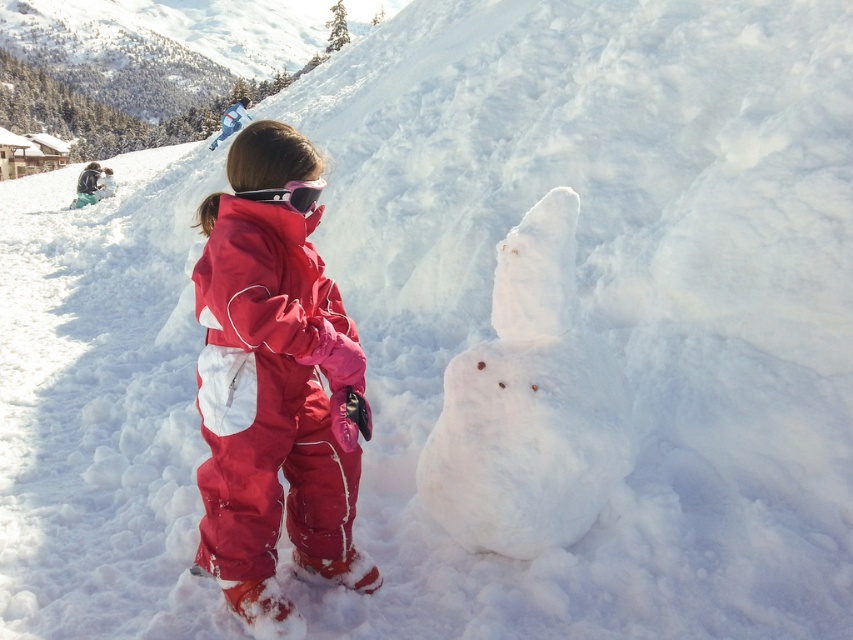
Does matte red snowsuit at center appear under pink matte goggles at center?

Correct, matte red snowsuit at center is located below pink matte goggles at center.

Can you confirm if matte red snowsuit at center is shorter than pink matte goggles at center?

Incorrect, matte red snowsuit at center's height does not fall short of pink matte goggles at center's.

Locate an element on the screen. The width and height of the screenshot is (853, 640). matte red snowsuit at center is located at coordinates (274, 392).

You are a GUI agent. You are given a task and a screenshot of the screen. Output one action in this format:
    pyautogui.click(x=<x>, y=<y>)
    Task: Click on the matte red snowsuit at center
    The image size is (853, 640).
    Given the screenshot: What is the action you would take?
    pyautogui.click(x=274, y=392)

Does white fluffy snowman at center have a lesser width compared to red matte snowsuit at center?

No, white fluffy snowman at center is not thinner than red matte snowsuit at center.

Is point (450, 360) less distant than point (229, 355)?

No, it is behind (229, 355).

The width and height of the screenshot is (853, 640). Identify the location of white fluffy snowman at center. (527, 404).

In the scene shown: Is white fluffy snowman at center below pink matte goggles at center?

Yes, white fluffy snowman at center is below pink matte goggles at center.

Can you confirm if white fluffy snowman at center is positioned to the right of pink matte goggles at center?

Yes, white fluffy snowman at center is to the right of pink matte goggles at center.

Measure the distance between white fluffy snowman at center and camera.

A distance of 11.92 feet exists between white fluffy snowman at center and camera.

Find the location of a particular element. This screenshot has width=853, height=640. white fluffy snowman at center is located at coordinates (527, 404).